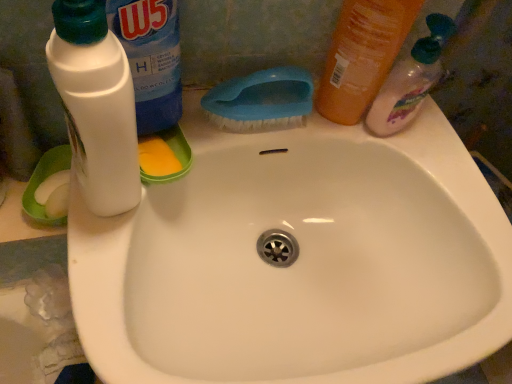
Question: Does white plastic bottle at upper left, the 3th cleaning product viewed from the right, come behind translucent plastic bottle at upper right, acting as the 2th cleaning product starting from the right?

Choices:
 (A) no
 (B) yes

Answer: (A)

Question: Is white plastic bottle at upper left, the 1th cleaning product from the left, turned away from translucent plastic bottle at upper right, acting as the 2th cleaning product starting from the right?

Choices:
 (A) no
 (B) yes

Answer: (A)

Question: Considering the relative sizes of white plastic bottle at upper left, the 1th cleaning product from the left, and translucent plastic bottle at upper right, acting as the 2th cleaning product starting from the right, in the image provided, is white plastic bottle at upper left, the 1th cleaning product from the left, bigger than translucent plastic bottle at upper right, acting as the 2th cleaning product starting from the right,?

Choices:
 (A) yes
 (B) no

Answer: (A)

Question: From the image's perspective, does white plastic bottle at upper left, the 1th cleaning product from the left, appear lower than translucent plastic bottle at upper right, acting as the 2th cleaning product starting from the right?

Choices:
 (A) yes
 (B) no

Answer: (B)

Question: From the image's perspective, is white plastic bottle at upper left, the 1th cleaning product from the left, on top of translucent plastic bottle at upper right, the 2th cleaning product from the left?

Choices:
 (A) no
 (B) yes

Answer: (B)

Question: Is translucent plastic bottle at upper right, marked as the 1th cleaning product in a right-to-left arrangement, to the left or to the right of white glossy sink at center in the image?

Choices:
 (A) left
 (B) right

Answer: (B)

Question: From a real-world perspective, is translucent plastic bottle at upper right, marked as the 1th cleaning product in a right-to-left arrangement, above or below white glossy sink at center?

Choices:
 (A) below
 (B) above

Answer: (B)

Question: From the image's perspective, relative to white glossy sink at center, is translucent plastic bottle at upper right, which is the third cleaning product in left-to-right order, above or below?

Choices:
 (A) below
 (B) above

Answer: (B)

Question: Is translucent plastic bottle at upper right, marked as the 1th cleaning product in a right-to-left arrangement, taller or shorter than white glossy sink at center?

Choices:
 (A) tall
 (B) short

Answer: (B)

Question: From a real-world perspective, relative to translucent plastic bottle at upper right, marked as the 1th cleaning product in a right-to-left arrangement, is translucent plastic bottle at upper right, acting as the 2th cleaning product starting from the right, vertically above or below?

Choices:
 (A) below
 (B) above

Answer: (B)

Question: Is translucent plastic bottle at upper right, the 2th cleaning product from the left, wider or thinner than translucent plastic bottle at upper right, marked as the 1th cleaning product in a right-to-left arrangement?

Choices:
 (A) wide
 (B) thin

Answer: (B)

Question: In terms of height, does translucent plastic bottle at upper right, acting as the 2th cleaning product starting from the right, look taller or shorter compared to translucent plastic bottle at upper right, marked as the 1th cleaning product in a right-to-left arrangement?

Choices:
 (A) short
 (B) tall

Answer: (B)

Question: Would you say translucent plastic bottle at upper right, the 2th cleaning product from the left, is to the left or to the right of translucent plastic bottle at upper right, marked as the 1th cleaning product in a right-to-left arrangement, in the picture?

Choices:
 (A) left
 (B) right

Answer: (A)

Question: Is white plastic bottle at upper left, the 1th cleaning product from the left, wider or thinner than translucent plastic bottle at upper right, acting as the 2th cleaning product starting from the right?

Choices:
 (A) thin
 (B) wide

Answer: (B)

Question: From the image's perspective, is white plastic bottle at upper left, the 1th cleaning product from the left, positioned above or below translucent plastic bottle at upper right, the 2th cleaning product from the left?

Choices:
 (A) above
 (B) below

Answer: (A)